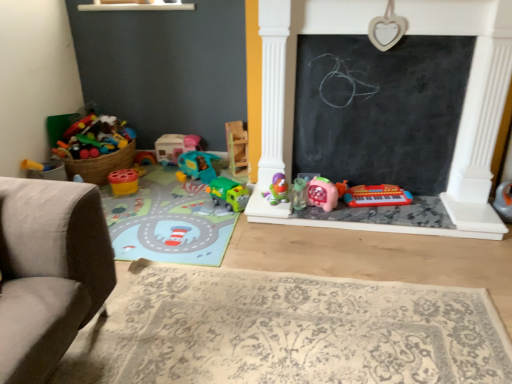
The image size is (512, 384). I want to click on free space to the left of teal plastic toy car at center, which appears as the 3th toy when viewed from the left, so point(161,175).